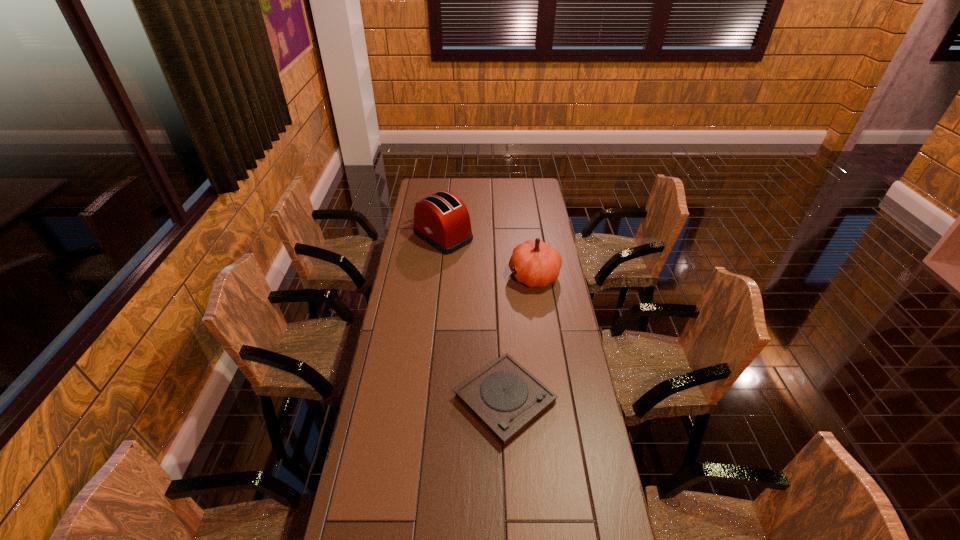
Identify the location of the farthest object. [x=442, y=220].

Find the location of a particular element. This screenshot has height=540, width=960. the second farthest object is located at coordinates (536, 264).

Identify the location of the nearest object. (505, 398).

Locate an element on the screen. the shortest object is located at coordinates (505, 398).

Locate an element on the screen. The image size is (960, 540). vacant space located 0.280m on the back of the farthest object is located at coordinates (447, 192).

Where is `free spot located on the front-facing side of the pumpkin`? The width and height of the screenshot is (960, 540). free spot located on the front-facing side of the pumpkin is located at coordinates (463, 275).

Locate an element on the screen. This screenshot has height=540, width=960. vacant point located 0.150m on the front-facing side of the pumpkin is located at coordinates (474, 275).

The height and width of the screenshot is (540, 960). What are the coordinates of `free spot located on the front-facing side of the pumpkin` in the screenshot? It's located at (486, 275).

Where is `blank space located on the back of the shortest object`? The width and height of the screenshot is (960, 540). blank space located on the back of the shortest object is located at coordinates (502, 333).

Locate an element on the screen. Image resolution: width=960 pixels, height=540 pixels. object at the left edge is located at coordinates (442, 220).